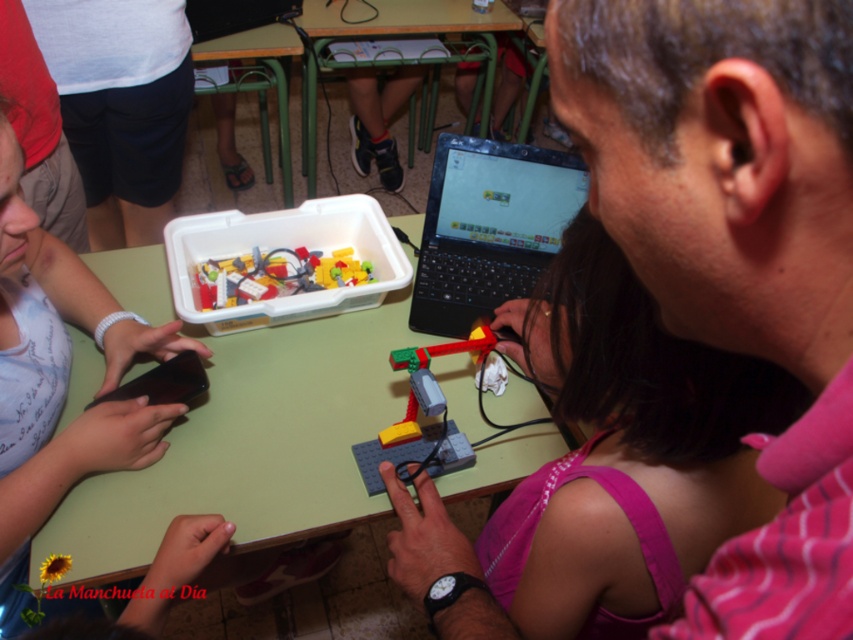
You are a student trying to place a heavy textbook on the green matte table at center without disturbing the black plastic laptop at center. Is the laptop likely to be affected by placing the textbook on the table?

The green matte table at center is positioned under black plastic laptop at center, so placing the textbook on the table might cause vibrations or shifts that could affect the laptop.